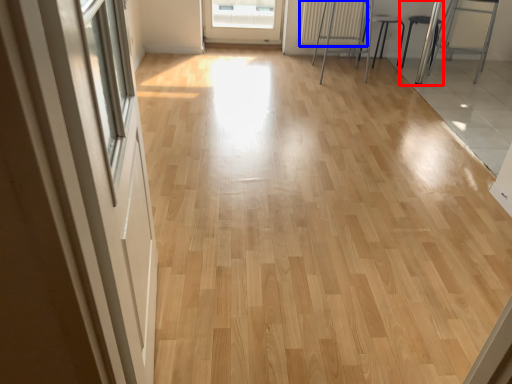
Question: Which of the following is the closest to the observer, armchair (highlighted by a red box) or radiator (highlighted by a blue box)?

Choices:
 (A) armchair
 (B) radiator

Answer: (A)